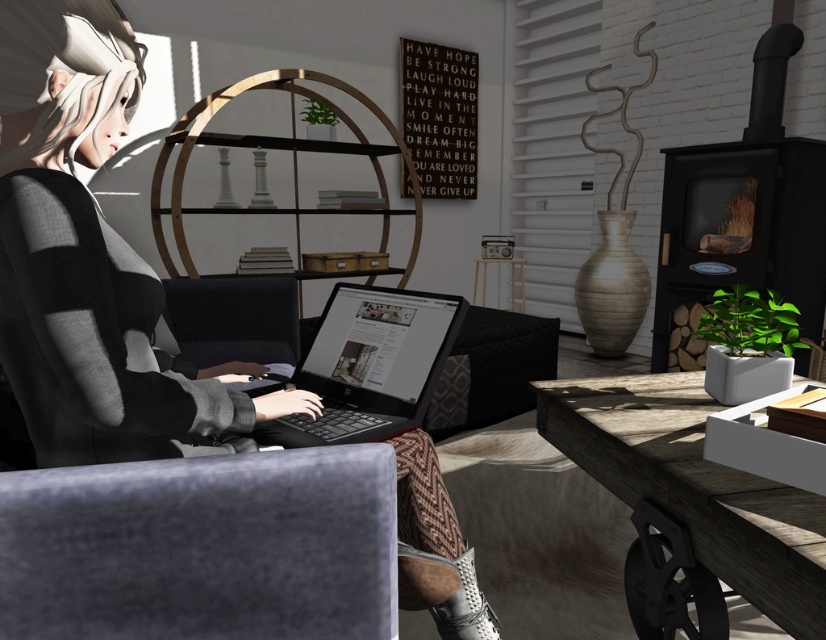
Question: Which point is farther from the camera taking this photo?

Choices:
 (A) (229, 300)
 (B) (608, 433)
 (C) (312, 336)

Answer: (A)

Question: Does black plastic laptop at center have a larger size compared to black fabric armchair at center?

Choices:
 (A) yes
 (B) no

Answer: (B)

Question: Does wooden table at lower right lie behind black fabric armchair at center?

Choices:
 (A) yes
 (B) no

Answer: (B)

Question: Which of the following is the farthest from the observer?

Choices:
 (A) (667, 403)
 (B) (13, 275)
 (C) (430, 296)
 (D) (244, 352)

Answer: (D)

Question: Based on their relative distances, which object is nearer to the black fabric armchair at center?

Choices:
 (A) black plastic laptop at center
 (B) matte black laptop at center
 (C) wooden table at lower right

Answer: (A)

Question: Is matte black laptop at center thinner than wooden table at lower right?

Choices:
 (A) no
 (B) yes

Answer: (A)